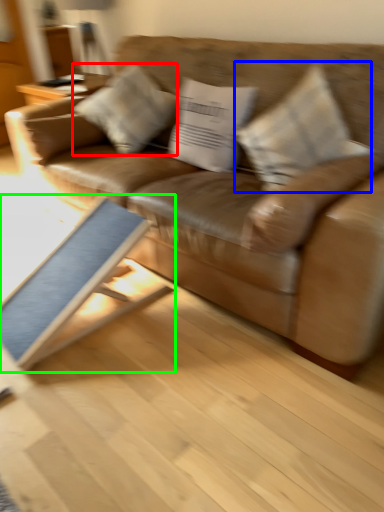
Question: Which object is positioned closest to pillow (highlighted by a red box)? Select from pillow (highlighted by a blue box) and table (highlighted by a green box).

Choices:
 (A) pillow
 (B) table

Answer: (B)